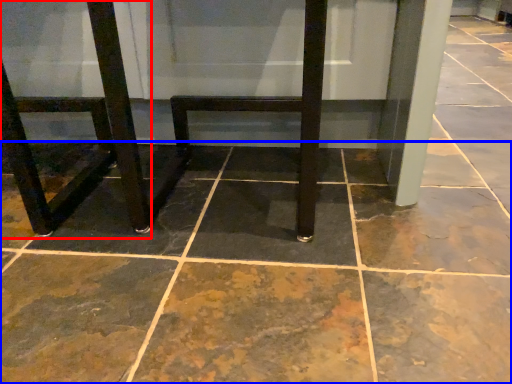
Question: Which of the following is the closest to the observer, chair (highlighted by a red box) or concrete (highlighted by a blue box)?

Choices:
 (A) chair
 (B) concrete

Answer: (B)